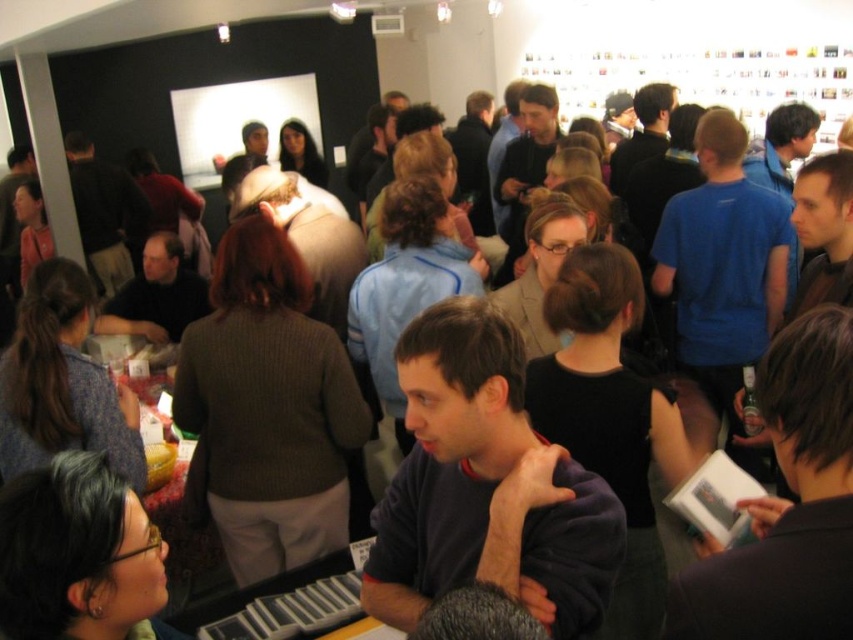
You are at a social event in a gallery with black and white walls. You see a point marked at coordinates (306, 237). What object is located at that point?

The point at coordinates (306, 237) indicates the location of the smooth beige shirt at center.

You are at the event and want to find the taller person between the dark brown sweater at center and the blue shirt at center. Which person should you look for?

The dark brown sweater at center is taller than the blue shirt at center, so you should look for the person wearing the dark brown sweater at center.